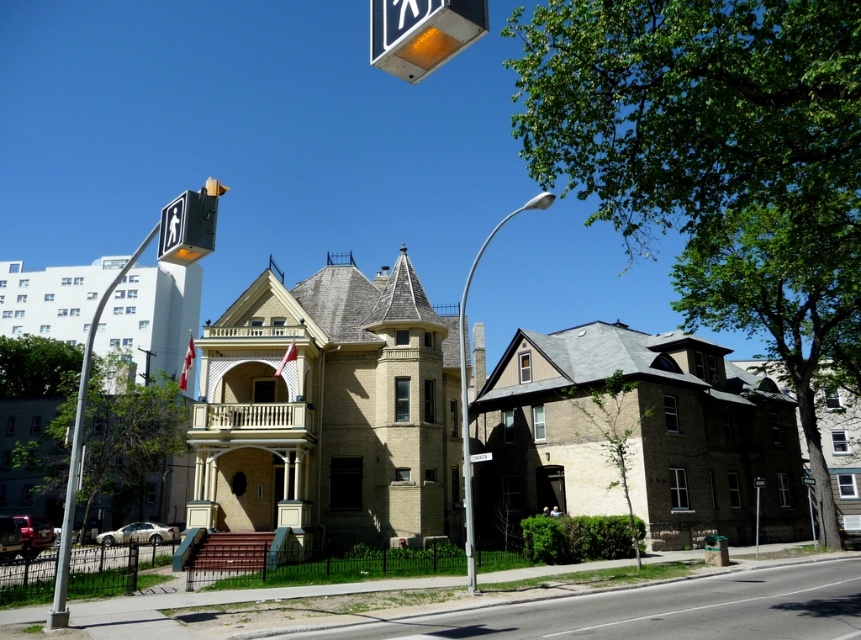
Can you confirm if yellow plastic pedestrian signal at upper left is wider than brushed metal pedestrian crossing sign at upper center?

Correct, the width of yellow plastic pedestrian signal at upper left exceeds that of brushed metal pedestrian crossing sign at upper center.

Locate an element on the screen. This screenshot has width=861, height=640. yellow plastic pedestrian signal at upper left is located at coordinates (189, 225).

In the scene shown: Who is taller, silver metallic pole at left or brushed metal pedestrian crossing sign at upper center?

With more height is silver metallic pole at left.

Is silver metallic pole at left bigger than brushed metal pedestrian crossing sign at upper center?

Correct, silver metallic pole at left is larger in size than brushed metal pedestrian crossing sign at upper center.

Which is in front, point (50, 612) or point (471, 454)?

Point (50, 612) is more forward.

Where is `silver metallic pole at left`? The image size is (861, 640). silver metallic pole at left is located at coordinates (79, 451).

Does point (135, 257) lie behind point (200, 196)?

That is True.

Between silver metallic pole at left and yellow plastic pedestrian signal at upper left, which one appears on the right side from the viewer's perspective?

Positioned to the right is yellow plastic pedestrian signal at upper left.

Between point (79, 417) and point (214, 208), which one is positioned in front?

Positioned in front is point (214, 208).

Identify the location of silver metallic pole at left. Image resolution: width=861 pixels, height=640 pixels. (79, 451).